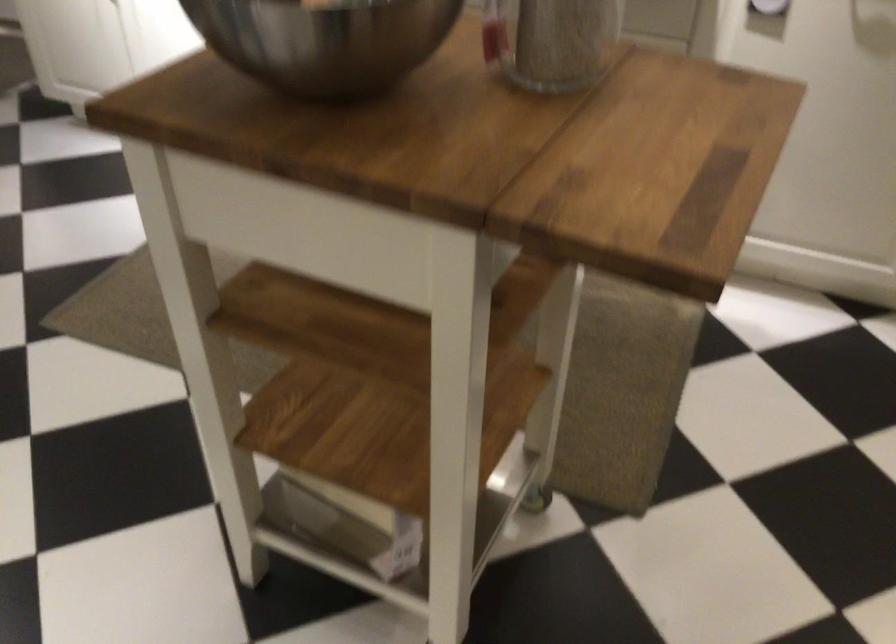
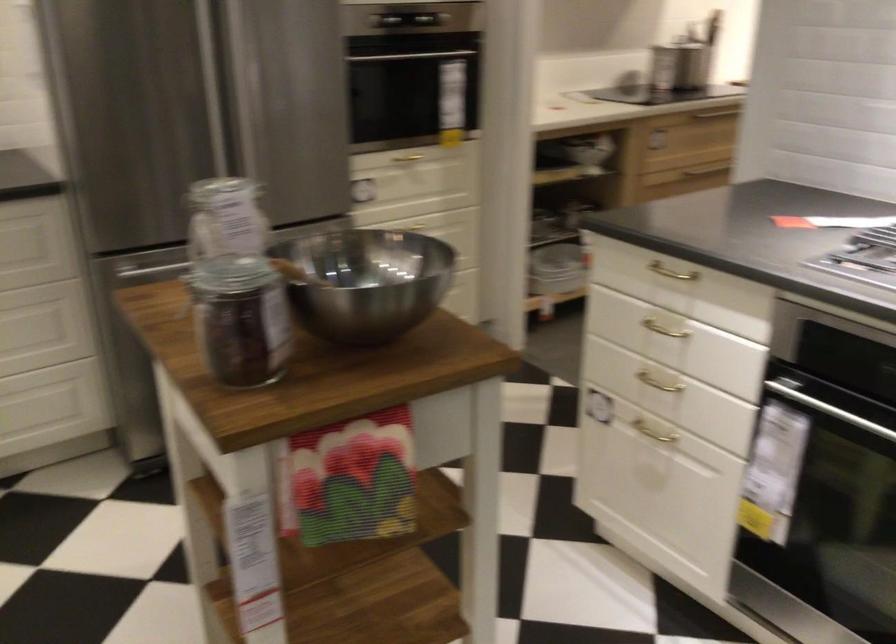
Where in the second image is the point corresponding to [325,73] from the first image?

(366, 281)